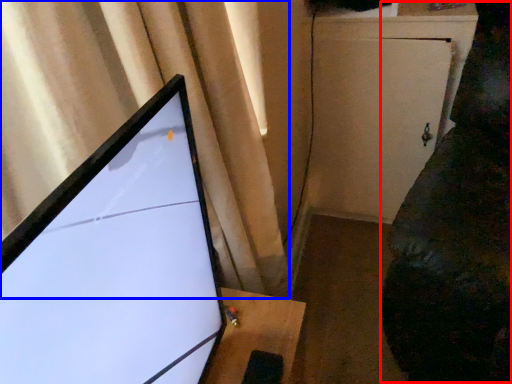
Question: Which object is closer to the camera taking this photo, couch (highlighted by a red box) or curtain (highlighted by a blue box)?

Choices:
 (A) couch
 (B) curtain

Answer: (B)